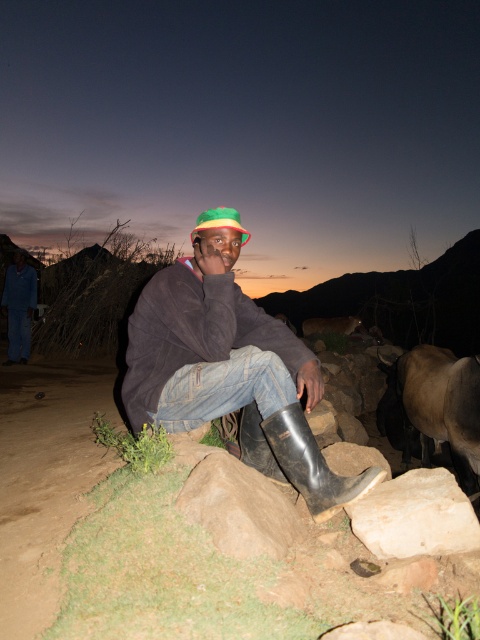
Question: Considering the real-world distances, which object is farthest from the brown rough rock at lower center?

Choices:
 (A) blue denim pants at lower left
 (B) multicolored fabric hat at center
 (C) black rubber boot at lower center
 (D) white smooth rock at lower right

Answer: (A)

Question: Which of the following is the closest to the observer?

Choices:
 (A) black rubber boot at lower center
 (B) brown rough rock at lower center
 (C) white smooth rock at lower right

Answer: (B)

Question: Is black rubber boot at lower center positioned before blue denim pants at lower left?

Choices:
 (A) yes
 (B) no

Answer: (A)

Question: Among these objects, which one is nearest to the camera?

Choices:
 (A) black rubber boot at lower center
 (B) white smooth rock at lower right
 (C) denim jeans at center
 (D) multicolored fabric hat at center

Answer: (A)

Question: Can you confirm if denim jeans at center is wider than brown rough rock at lower center?

Choices:
 (A) yes
 (B) no

Answer: (A)

Question: Is denim jeans at center positioned before white smooth rock at lower right?

Choices:
 (A) yes
 (B) no

Answer: (B)